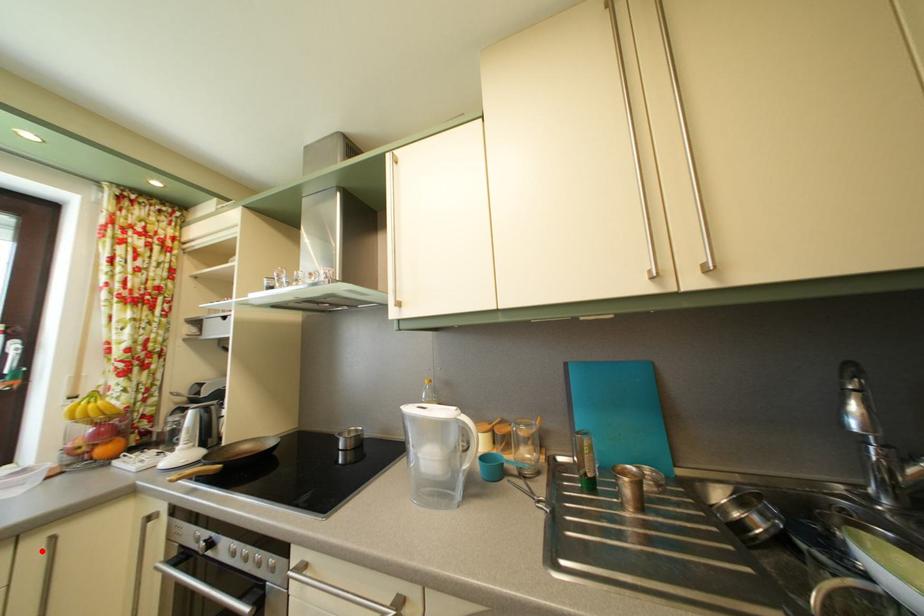
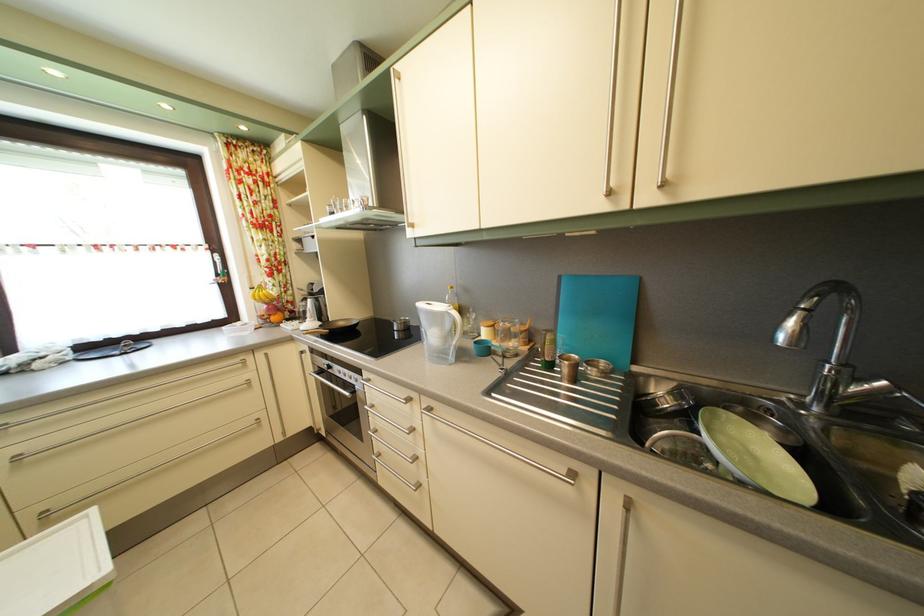
Question: A red point is marked in image1. In image2, is the corresponding 3D point closer to the camera or farther? Reply with the corresponding letter.

Choices:
 (A) The corresponding 3D point is closer.
 (B) The corresponding 3D point is farther.

Answer: (B)